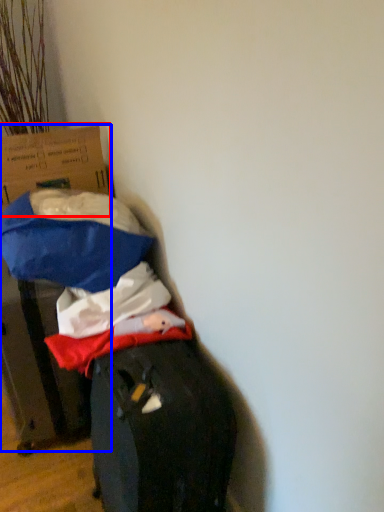
Question: Which object appears closest to the camera in this image, cardboard box (highlighted by a red box) or cardboard box (highlighted by a blue box)?

Choices:
 (A) cardboard box
 (B) cardboard box

Answer: (B)